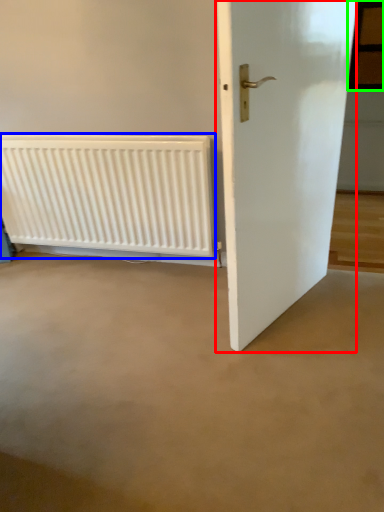
Question: Which object is the farthest from door (highlighted by a red box)? Choose among these: radiator (highlighted by a blue box) or window (highlighted by a green box).

Choices:
 (A) radiator
 (B) window

Answer: (B)